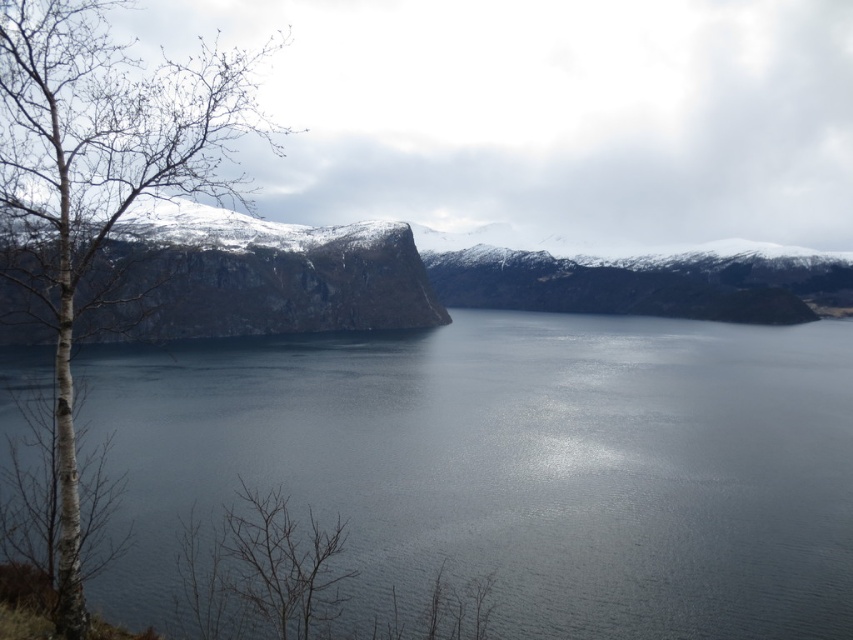
You are an environmental scientist observing the fjord landscape. You notice the dark gray water at center and the bare bark tree at left. Which object is positioned lower in the scene?

The dark gray water at center is positioned lower than the bare bark tree at left, as it is described to be below it.

You are a hiker standing at the snowy rock cliff at left and want to reach the dark gray water at center. Which direction should you move to get there?

You should move to the right to reach the dark gray water at center since it is located to the right of the snowy rock cliff at left.